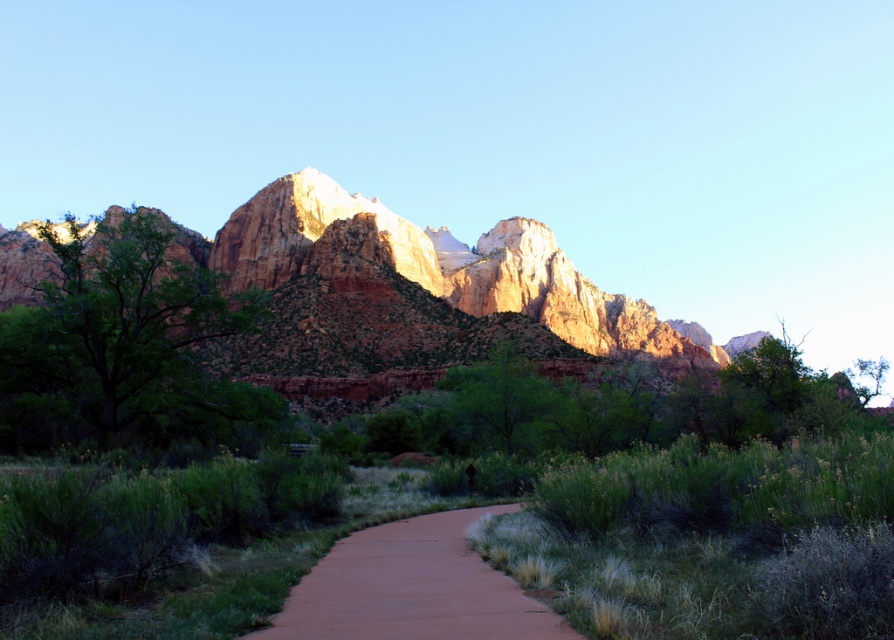
You are standing at the point marked by the coordinates point [410,296] in the image. Based on the scene description, what type of terrain are you currently standing on?

You are standing on a rustic rock formation at center as indicated by the coordinates point [410,296].